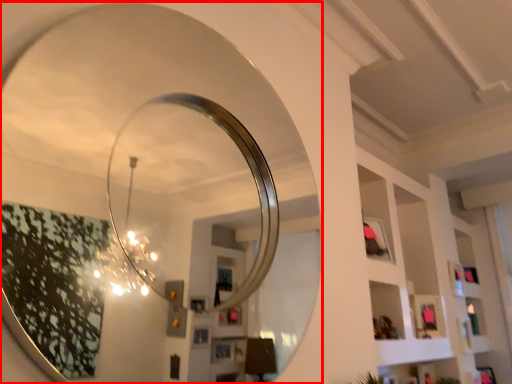
Question: From the image's perspective, what is the correct spatial positioning of mirror (annotated by the red box) in reference to shelf?

Choices:
 (A) below
 (B) above

Answer: (B)